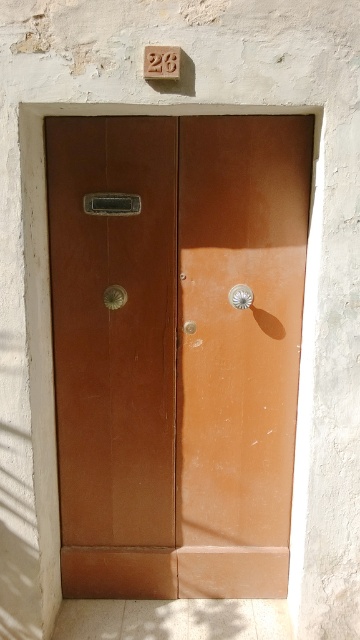
Question: Can you confirm if matte brass door handle at center is positioned below polished brass knob at center?

Choices:
 (A) no
 (B) yes

Answer: (A)

Question: Which of the following is the closest to the observer?

Choices:
 (A) (189, 328)
 (B) (240, 300)
 (C) (115, 198)
 (D) (120, 307)

Answer: (C)

Question: Estimate the real-world distances between objects in this image. Which object is closer to the polished brass knob at center?

Choices:
 (A) matte brass door handle at center
 (B) matte metallic door handle at center

Answer: (B)

Question: Is metallic brass door handle at center to the left of matte metallic door handle at center from the viewer's perspective?

Choices:
 (A) no
 (B) yes

Answer: (A)

Question: Which object appears closest to the camera in this image?

Choices:
 (A) matte metallic door handle at center
 (B) matte brass door handle at center

Answer: (B)

Question: Does metallic brass door handle at center have a larger size compared to matte metallic door handle at center?

Choices:
 (A) no
 (B) yes

Answer: (B)